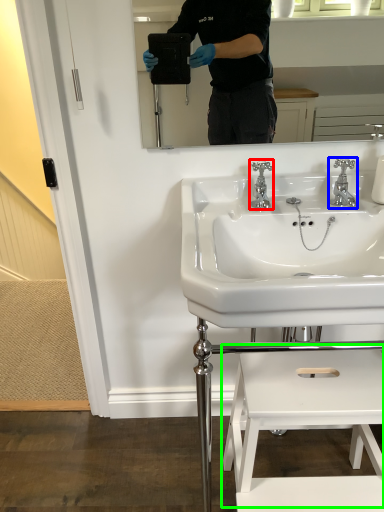
Question: Considering the real-world distances, which object is farthest from tap (highlighted by a red box)? tap (highlighted by a blue box) or step stool (highlighted by a green box)?

Choices:
 (A) tap
 (B) step stool

Answer: (B)